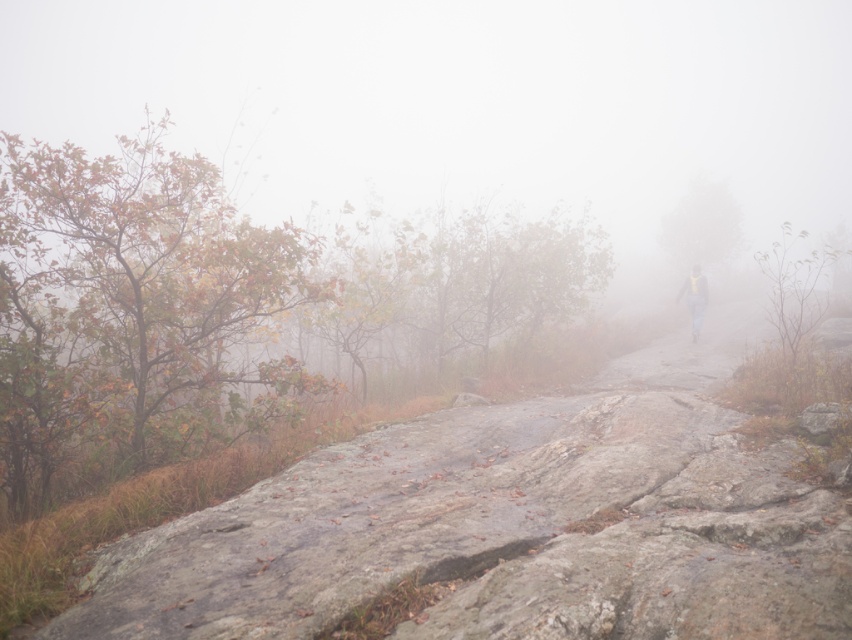
Can you confirm if gray rough rock at center is wider than yellow reflective vest at center?

Yes, gray rough rock at center is wider than yellow reflective vest at center.

Who is taller, gray rough rock at center or yellow reflective vest at center?

With more height is yellow reflective vest at center.

The width and height of the screenshot is (852, 640). What are the coordinates of `gray rough rock at center` in the screenshot? It's located at (511, 525).

Where is `gray rough rock at center`? gray rough rock at center is located at coordinates (511, 525).